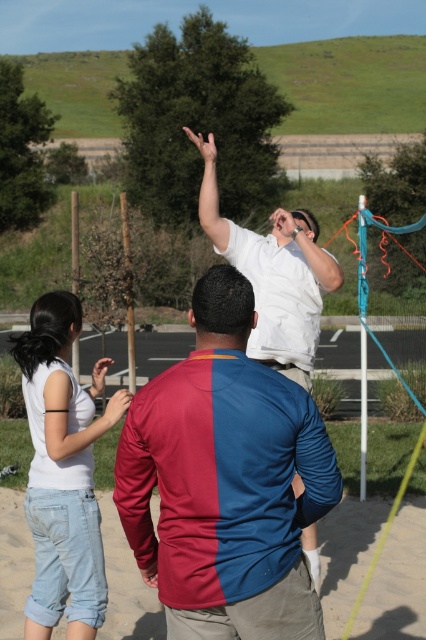
Question: Which is nearer to the maroon and blue jersey at center?

Choices:
 (A) white matte shirt at upper center
 (B) light blue denim shorts at lower left
 (C) brown sandy ground at lower center

Answer: (A)

Question: Is maroon and blue jersey at center below brown sandy ground at lower center?

Choices:
 (A) no
 (B) yes

Answer: (A)

Question: Which of the following is the closest to the observer?

Choices:
 (A) brown sandy ground at lower center
 (B) maroon and blue jersey at center
 (C) white matte shirt at upper center

Answer: (B)

Question: Does maroon and blue jersey at center come in front of white matte shirt at upper center?

Choices:
 (A) no
 (B) yes

Answer: (B)

Question: Estimate the real-world distances between objects in this image. Which object is farther from the maroon and blue jersey at center?

Choices:
 (A) white matte shirt at upper center
 (B) brown sandy ground at lower center

Answer: (B)

Question: Can you confirm if maroon and blue jersey at center is wider than light blue denim shorts at lower left?

Choices:
 (A) no
 (B) yes

Answer: (B)